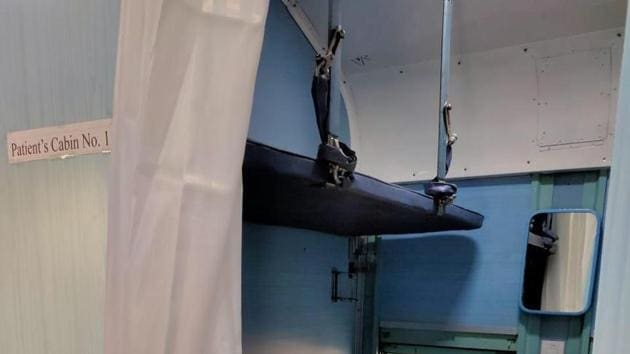
Locate an element on the screen. This screenshot has height=354, width=630. mirror is located at coordinates (564, 255).